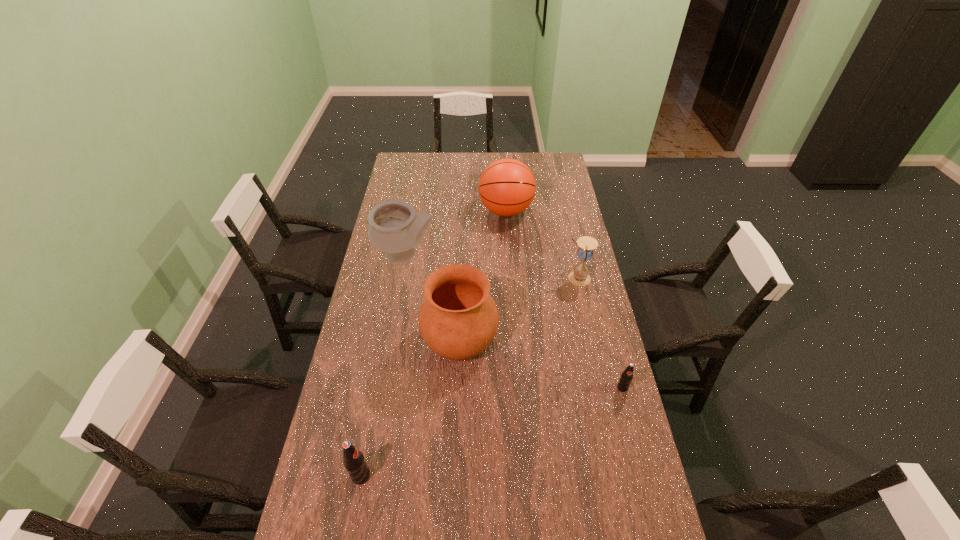
What are the coordinates of `free space located on the left of the nearer pottery` in the screenshot? It's located at (369, 340).

This screenshot has width=960, height=540. I want to click on free location located on the back of the basketball, so click(x=503, y=172).

Identify the location of vacant point located on the back of the farther pottery. The width and height of the screenshot is (960, 540). (417, 192).

In order to click on vacant space situated on the back of the hourglass in this screenshot , I will do `click(568, 235)`.

Where is `pop that is at the left edge`? This screenshot has width=960, height=540. pop that is at the left edge is located at coordinates (353, 459).

You are a GUI agent. You are given a task and a screenshot of the screen. Output one action in this format:
    pyautogui.click(x=<x>, y=<y>)
    Task: Click on the pottery that is at the left edge
    
    Given the screenshot: What is the action you would take?
    pyautogui.click(x=394, y=228)

The width and height of the screenshot is (960, 540). In order to click on pop at the right edge in this screenshot , I will do `click(626, 378)`.

Where is `hourglass located at the right edge`? The image size is (960, 540). hourglass located at the right edge is located at coordinates (579, 276).

The width and height of the screenshot is (960, 540). In order to click on free region at the far edge of the desktop in this screenshot , I will do `click(429, 158)`.

Locate an element on the screen. The height and width of the screenshot is (540, 960). vacant space at the left edge of the desktop is located at coordinates (364, 339).